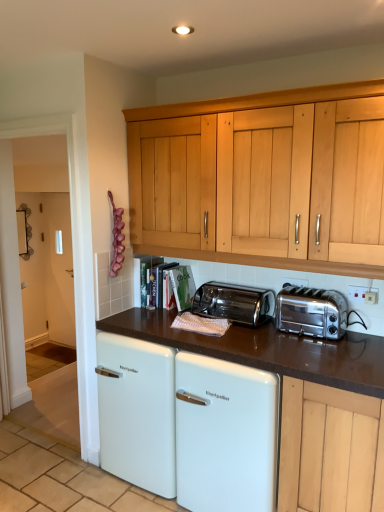
This screenshot has height=512, width=384. Identify the location of white enamel refrigerator at center. (268, 350).

Find the location of a particular element. The height and width of the screenshot is (512, 384). white glossy refrigerator at center is located at coordinates (225, 435).

The image size is (384, 512). What do you see at coordinates (225, 435) in the screenshot?
I see `white glossy refrigerator at center` at bounding box center [225, 435].

What are the coordinates of `polished stainless steel toaster at center, placed as the 2th toaster when sorted from right to left` in the screenshot? It's located at (234, 303).

This screenshot has height=512, width=384. Find the location of `silver metallic electric outlet at upper right, placed as the second electric outlet when sorted from right to left`. silver metallic electric outlet at upper right, placed as the second electric outlet when sorted from right to left is located at coordinates (295, 282).

Can you see satin chrome toaster at right, acting as the second toaster starting from the left, touching transparent glass door at left?

satin chrome toaster at right, acting as the second toaster starting from the left, and transparent glass door at left are not in contact.

From a real-world perspective, between satin chrome toaster at right, acting as the second toaster starting from the left, and transparent glass door at left, who is vertically higher?

transparent glass door at left is physically above.

How many degrees apart are the facing directions of satin chrome toaster at right, marked as the first toaster in a right-to-left arrangement, and transparent glass door at left?

There is a 0.681-degree angle between the facing directions of satin chrome toaster at right, marked as the first toaster in a right-to-left arrangement, and transparent glass door at left.

Is satin chrome toaster at right, acting as the second toaster starting from the left, wider than transparent glass door at left?

Correct, the width of satin chrome toaster at right, acting as the second toaster starting from the left, exceeds that of transparent glass door at left.

Between white enamel refrigerator at center and transparent glass door at left, which one is positioned in front?

white enamel refrigerator at center is more forward.

From the image's perspective, is white enamel refrigerator at center on top of transparent glass door at left?

Actually, white enamel refrigerator at center appears below transparent glass door at left in the image.

From a real-world perspective, does white enamel refrigerator at center sit lower than transparent glass door at left?

Yes, from a real-world perspective, white enamel refrigerator at center is under transparent glass door at left.

Is white enamel refrigerator at center not near transparent glass door at left?

white enamel refrigerator at center is near transparent glass door at left, not far away.

From a real-world perspective, is white plastic electrical outlet at upper right, which is the first electric outlet in right-to-left order, on top of silver metallic electric outlet at upper right, placed as the second electric outlet when sorted from right to left?

No.

In the scene shown: From the image's perspective, is white plastic electrical outlet at upper right, which appears as the second electric outlet when viewed from the back, under silver metallic electric outlet at upper right, placed as the second electric outlet when sorted from right to left?

Indeed, from the image's perspective, white plastic electrical outlet at upper right, which appears as the second electric outlet when viewed from the back, is shown beneath silver metallic electric outlet at upper right, placed as the second electric outlet when sorted from right to left.

Looking at this image, how different are the orientations of white plastic electrical outlet at upper right, which appears as the second electric outlet when viewed from the back, and silver metallic electric outlet at upper right, placed as the 2th electric outlet when sorted from front to back, in degrees?

The facing directions of white plastic electrical outlet at upper right, which appears as the second electric outlet when viewed from the back, and silver metallic electric outlet at upper right, placed as the 2th electric outlet when sorted from front to back, are 0.0471 degrees apart.

Is white plastic electrical outlet at upper right, which is the first electric outlet in right-to-left order, completely or partially outside of silver metallic electric outlet at upper right, positioned as the first electric outlet in left-to-right order?

Yes, white plastic electrical outlet at upper right, which is the first electric outlet in right-to-left order, is located beyond the bounds of silver metallic electric outlet at upper right, positioned as the first electric outlet in left-to-right order.

Considering the sizes of objects transparent glass door at left and white glossy refrigerator at center in the image provided, who is wider, transparent glass door at left or white glossy refrigerator at center?

With larger width is white glossy refrigerator at center.

Is transparent glass door at left to the left of white glossy refrigerator at center from the viewer's perspective?

Yes.

Looking at this image, does transparent glass door at left turn towards white glossy refrigerator at center?

No, transparent glass door at left is not turned towards white glossy refrigerator at center.

Is transparent glass door at left in front of white glossy refrigerator at center?

No, the depth of transparent glass door at left is greater than that of white glossy refrigerator at center.

Are white enamel refrigerator at center and white plastic electrical outlet at upper right, which is the first electric outlet in right-to-left order, located far from each other?

That's not correct — white enamel refrigerator at center is a little close to white plastic electrical outlet at upper right, which is the first electric outlet in right-to-left order.

Is white enamel refrigerator at center positioned with its back to white plastic electrical outlet at upper right, which ranks as the second electric outlet in left-to-right order?

That's not correct — white enamel refrigerator at center is not looking away from white plastic electrical outlet at upper right, which ranks as the second electric outlet in left-to-right order.

Can you tell me how much white enamel refrigerator at center and white plastic electrical outlet at upper right, which is the first electric outlet in right-to-left order, differ in facing direction?

There is a 0.482-degree angle between the facing directions of white enamel refrigerator at center and white plastic electrical outlet at upper right, which is the first electric outlet in right-to-left order.

Considering the relative sizes of white enamel refrigerator at center and white plastic electrical outlet at upper right, which ranks as the second electric outlet in left-to-right order, in the image provided, is white enamel refrigerator at center smaller than white plastic electrical outlet at upper right, which ranks as the second electric outlet in left-to-right order,?

No, white enamel refrigerator at center is not smaller than white plastic electrical outlet at upper right, which ranks as the second electric outlet in left-to-right order.

From the image's perspective, is transparent glass door at left on silver metallic electric outlet at upper right, placed as the 2th electric outlet when sorted from front to back?

No, from the image's perspective, transparent glass door at left is not above silver metallic electric outlet at upper right, placed as the 2th electric outlet when sorted from front to back.

Is point (79, 407) behind point (289, 278)?

Yes.

What are the coordinates of `glass door on the left of silver metallic electric outlet at upper right, which is the 1th electric outlet from back to front` in the screenshot? It's located at (71, 220).

Is transparent glass door at left closer to camera compared to silver metallic electric outlet at upper right, placed as the second electric outlet when sorted from right to left?

Yes, transparent glass door at left is closer to the viewer.

Can you confirm if transparent glass door at left is wider than polished stainless steel toaster at center, placed as the 2th toaster when sorted from right to left?

Incorrect, the width of transparent glass door at left does not surpass that of polished stainless steel toaster at center, placed as the 2th toaster when sorted from right to left.

Is transparent glass door at left positioned with its back to polished stainless steel toaster at center, placed as the first toaster when sorted from left to right?

No, transparent glass door at left is not facing away from polished stainless steel toaster at center, placed as the first toaster when sorted from left to right.

Which of these two, transparent glass door at left or polished stainless steel toaster at center, placed as the first toaster when sorted from left to right, is bigger?

Bigger between the two is transparent glass door at left.

From the image's perspective, is transparent glass door at left above or below polished stainless steel toaster at center, placed as the 2th toaster when sorted from right to left?

From the image's perspective, transparent glass door at left appears above polished stainless steel toaster at center, placed as the 2th toaster when sorted from right to left.

From the image's perspective, which toaster is the 2nd one below the transparent glass door at left? Please provide its 2D coordinates.

[(311, 312)]

Locate an element on the screen. The image size is (384, 512). appliance that appears in front of the transparent glass door at left is located at coordinates (268, 350).

Considering their positions, is polished stainless steel toaster at center, placed as the first toaster when sorted from left to right, positioned further to white glossy refrigerator at center than transparent glass door at left?

transparent glass door at left lies further to white glossy refrigerator at center than the other object.

Considering their positions, is silver metallic electric outlet at upper right, placed as the second electric outlet when sorted from right to left, positioned closer to polished stainless steel toaster at center, placed as the first toaster when sorted from left to right, than white enamel refrigerator at center?

The object closer to polished stainless steel toaster at center, placed as the first toaster when sorted from left to right, is white enamel refrigerator at center.

Estimate the real-world distances between objects in this image. Which object is closer to white glossy refrigerator at center, polished stainless steel toaster at center, placed as the first toaster when sorted from left to right, or white plastic electrical outlet at upper right, which ranks as the second electric outlet in left-to-right order?

polished stainless steel toaster at center, placed as the first toaster when sorted from left to right, lies closer to white glossy refrigerator at center than the other object.

Looking at the image, which one is located closer to white plastic electrical outlet at upper right, which ranks as the second electric outlet in left-to-right order, white enamel refrigerator at center or white glossy refrigerator at center?

The object closer to white plastic electrical outlet at upper right, which ranks as the second electric outlet in left-to-right order, is white enamel refrigerator at center.

Considering their positions, is white enamel refrigerator at center positioned closer to silver metallic electric outlet at upper right, positioned as the first electric outlet in left-to-right order, than polished stainless steel toaster at center, placed as the first toaster when sorted from left to right?

polished stainless steel toaster at center, placed as the first toaster when sorted from left to right, is positioned closer to the anchor silver metallic electric outlet at upper right, positioned as the first electric outlet in left-to-right order.

Based on their spatial positions, is transparent glass door at left or satin chrome toaster at right, marked as the first toaster in a right-to-left arrangement, closer to silver metallic electric outlet at upper right, which is the 1th electric outlet from back to front?

satin chrome toaster at right, marked as the first toaster in a right-to-left arrangement, is positioned closer to the anchor silver metallic electric outlet at upper right, which is the 1th electric outlet from back to front.

When comparing their distances from white plastic electrical outlet at upper right, positioned as the first electric outlet in front-to-back order, does polished stainless steel toaster at center, placed as the first toaster when sorted from left to right, or satin chrome toaster at right, acting as the second toaster starting from the left, seem further?

Based on the image, polished stainless steel toaster at center, placed as the first toaster when sorted from left to right, appears to be further to white plastic electrical outlet at upper right, positioned as the first electric outlet in front-to-back order.

Considering their positions, is white plastic electrical outlet at upper right, which appears as the second electric outlet when viewed from the back, positioned closer to transparent glass door at left than polished stainless steel toaster at center, placed as the 2th toaster when sorted from right to left?

polished stainless steel toaster at center, placed as the 2th toaster when sorted from right to left, is positioned closer to the anchor transparent glass door at left.

Where is `appliance between transparent glass door at left and white glossy refrigerator at center`? The width and height of the screenshot is (384, 512). appliance between transparent glass door at left and white glossy refrigerator at center is located at coordinates (268, 350).

Where is `electric outlet between polished stainless steel toaster at center, placed as the first toaster when sorted from left to right, and white plastic electrical outlet at upper right, which ranks as the second electric outlet in left-to-right order, in the horizontal direction`? This screenshot has height=512, width=384. electric outlet between polished stainless steel toaster at center, placed as the first toaster when sorted from left to right, and white plastic electrical outlet at upper right, which ranks as the second electric outlet in left-to-right order, in the horizontal direction is located at coordinates (295, 282).

Locate an element on the screen. The height and width of the screenshot is (512, 384). toaster between transparent glass door at left and white enamel refrigerator at center is located at coordinates (234, 303).

At what (x,y) coordinates should I click in order to perform the action: click on home appliance between transparent glass door at left and silver metallic electric outlet at upper right, positioned as the first electric outlet in left-to-right order. Please return your answer as a coordinate pair (x, y). This screenshot has height=512, width=384. Looking at the image, I should click on (225, 435).